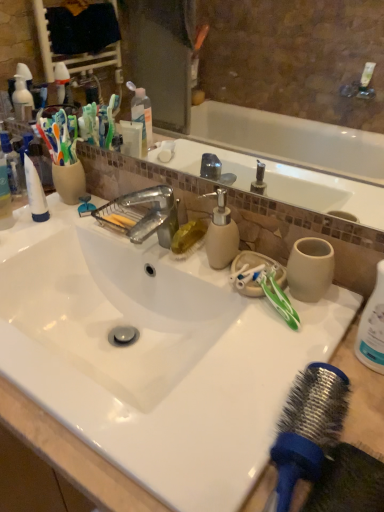
Question: Considering the relative sizes of blue rubber hair brush at lower right and beige matte soap dispenser at center in the image provided, is blue rubber hair brush at lower right smaller than beige matte soap dispenser at center?

Choices:
 (A) yes
 (B) no

Answer: (B)

Question: From a real-world perspective, is blue rubber hair brush at lower right below beige matte soap dispenser at center?

Choices:
 (A) no
 (B) yes

Answer: (B)

Question: From the image's perspective, is blue rubber hair brush at lower right over beige matte soap dispenser at center?

Choices:
 (A) yes
 (B) no

Answer: (B)

Question: Is blue rubber hair brush at lower right oriented away from beige matte soap dispenser at center?

Choices:
 (A) yes
 (B) no

Answer: (B)

Question: Is blue rubber hair brush at lower right behind beige matte soap dispenser at center?

Choices:
 (A) yes
 (B) no

Answer: (B)

Question: Looking at the image, does green plastic toothbrush at right seem bigger or smaller compared to white glossy sink at center?

Choices:
 (A) small
 (B) big

Answer: (A)

Question: In the image, is green plastic toothbrush at right positioned in front of or behind white glossy sink at center?

Choices:
 (A) behind
 (B) front

Answer: (A)

Question: Is point (274, 308) positioned closer to the camera than point (160, 362)?

Choices:
 (A) farther
 (B) closer

Answer: (B)

Question: Is green plastic toothbrush at right wider or thinner than white glossy sink at center?

Choices:
 (A) thin
 (B) wide

Answer: (A)

Question: Considering the positions of blue rubber hair brush at lower right and metallic faucet at center in the image, is blue rubber hair brush at lower right taller or shorter than metallic faucet at center?

Choices:
 (A) short
 (B) tall

Answer: (A)

Question: Considering the relative positions of blue rubber hair brush at lower right and metallic faucet at center in the image provided, is blue rubber hair brush at lower right to the left or to the right of metallic faucet at center?

Choices:
 (A) right
 (B) left

Answer: (A)

Question: From a real-world perspective, is blue rubber hair brush at lower right positioned above or below metallic faucet at center?

Choices:
 (A) above
 (B) below

Answer: (B)

Question: From the image's perspective, relative to metallic faucet at center, is blue rubber hair brush at lower right above or below?

Choices:
 (A) below
 (B) above

Answer: (A)

Question: Considering their positions, is green plastic toothbrush at right located in front of or behind metallic faucet at center?

Choices:
 (A) front
 (B) behind

Answer: (A)

Question: Based on their sizes in the image, would you say green plastic toothbrush at right is bigger or smaller than metallic faucet at center?

Choices:
 (A) big
 (B) small

Answer: (B)